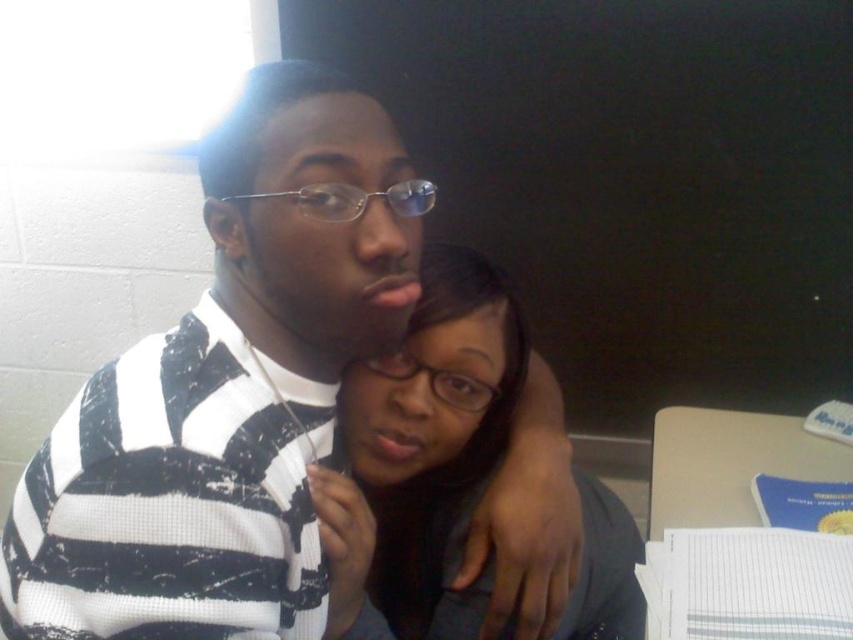
Question: In this image, where is striped knit sweater at center located relative to matte black hair at center?

Choices:
 (A) left
 (B) right

Answer: (A)

Question: Can you confirm if striped knit sweater at center is smaller than matte black hair at center?

Choices:
 (A) no
 (B) yes

Answer: (A)

Question: Does striped knit sweater at center appear under matte black hair at center?

Choices:
 (A) no
 (B) yes

Answer: (A)

Question: Among these objects, which one is farthest from the camera?

Choices:
 (A) matte black hair at center
 (B) striped knit sweater at center

Answer: (A)

Question: Which point is closer to the camera?

Choices:
 (A) (309, 349)
 (B) (503, 308)

Answer: (A)